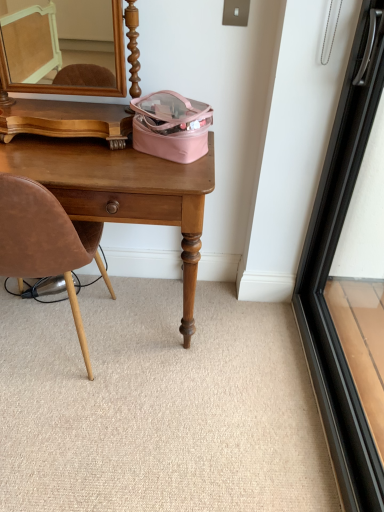
At what (x,y) coordinates should I click in order to perform the action: click on brown leather chair at left. Please return your answer as a coordinate pair (x, y). This screenshot has height=512, width=384. Looking at the image, I should click on (45, 242).

What do you see at coordinates (158, 405) in the screenshot? I see `beige carpet at lower center` at bounding box center [158, 405].

You are a GUI agent. You are given a task and a screenshot of the screen. Output one action in this format:
    pyautogui.click(x=<x>, y=<y>)
    Task: Click on the wooden desk at center
    The width and height of the screenshot is (384, 512).
    Given the screenshot: What is the action you would take?
    pyautogui.click(x=122, y=192)

Could you tell me if brown leather chair at left is turned towards beige carpet at lower center?

No, brown leather chair at left is not facing towards beige carpet at lower center.

In the scene shown: Which of these two, brown leather chair at left or beige carpet at lower center, is smaller?

With smaller size is beige carpet at lower center.

Which of these two, brown leather chair at left or beige carpet at lower center, stands shorter?

Standing shorter between the two is beige carpet at lower center.

From a real-world perspective, who is located higher, brown leather chair at left or beige carpet at lower center?

In real-world perspective, brown leather chair at left is above.

Is beige carpet at lower center taller than black glass screen door at right?

Incorrect, the height of beige carpet at lower center is not larger of that of black glass screen door at right.

Does beige carpet at lower center touch black glass screen door at right?

No, beige carpet at lower center is not touching black glass screen door at right.

Looking at this image, who is smaller, beige carpet at lower center or black glass screen door at right?

With smaller size is beige carpet at lower center.

Between black glass screen door at right and wooden desk at center, which one appears on the right side from the viewer's perspective?

From the viewer's perspective, black glass screen door at right appears more on the right side.

Between black glass screen door at right and wooden desk at center, which one has larger size?

wooden desk at center is bigger.

Who is shorter, black glass screen door at right or wooden desk at center?

wooden desk at center.

Does point (171, 185) appear closer or farther from the camera than point (38, 264)?

Clearly, point (171, 185) is closer to the camera than point (38, 264).

Is wooden desk at center bigger than brown leather chair at left?

Yes.

Does wooden desk at center contain brown leather chair at left?

Absolutely, brown leather chair at left is inside wooden desk at center.

From the image's perspective, is wooden desk at center above or below brown leather chair at left?

wooden desk at center is above brown leather chair at left.

From the picture: Which object is wider, brown leather chair at left or wooden desk at center?

brown leather chair at left.

Between brown leather chair at left and wooden desk at center, which one appears on the left side from the viewer's perspective?

From the viewer's perspective, brown leather chair at left appears more on the left side.

Consider the image. Is brown leather chair at left spatially inside wooden desk at center, or outside of it?

brown leather chair at left fits inside wooden desk at center.

Consider the image. From their relative heights in the image, would you say brown leather chair at left is taller or shorter than wooden desk at center?

brown leather chair at left is taller than wooden desk at center.

At what (x,y) coordinates should I click in order to perform the action: click on desk on the left of beige carpet at lower center. Please return your answer as a coordinate pair (x, y). Looking at the image, I should click on (122, 192).

Is beige carpet at lower center turned away from wooden desk at center?

No, beige carpet at lower center's orientation is not away from wooden desk at center.

Between point (306, 386) and point (9, 167), which one is positioned behind?

The point (306, 386) is farther from the camera.

Consider the image. Is wooden desk at center further to the viewer compared to beige carpet at lower center?

Yes, it is.

From a real-world perspective, which is physically below, wooden desk at center or beige carpet at lower center?

beige carpet at lower center.

Is wooden desk at center placed right next to beige carpet at lower center?

wooden desk at center and beige carpet at lower center are not in contact.

Does wooden desk at center have a larger size compared to beige carpet at lower center?

Indeed, wooden desk at center has a larger size compared to beige carpet at lower center.

Identify the location of chair on the left side of beige carpet at lower center. (45, 242).

The width and height of the screenshot is (384, 512). Find the location of `plain that appears below the black glass screen door at right (from a real-world perspective)`. plain that appears below the black glass screen door at right (from a real-world perspective) is located at coordinates (158, 405).

Looking at the image, which one is located closer to black glass screen door at right, wooden desk at center or beige carpet at lower center?

Based on the image, beige carpet at lower center appears to be nearer to black glass screen door at right.

From the image, which object appears to be nearer to brown leather chair at left, wooden desk at center or black glass screen door at right?

The object closer to brown leather chair at left is wooden desk at center.

Based on the photo, looking at the image, which one is located closer to black glass screen door at right, wooden desk at center or brown leather chair at left?

wooden desk at center is closer to black glass screen door at right.

When comparing their distances from black glass screen door at right, does brown leather chair at left or beige carpet at lower center seem further?

Based on the image, brown leather chair at left appears to be further to black glass screen door at right.

From the image, which object appears to be nearer to wooden desk at center, brown leather chair at left or black glass screen door at right?

brown leather chair at left lies closer to wooden desk at center than the other object.

Which object lies nearer to the anchor point beige carpet at lower center, wooden desk at center or brown leather chair at left?

The object closer to beige carpet at lower center is brown leather chair at left.

Based on their spatial positions, is wooden desk at center or beige carpet at lower center further from brown leather chair at left?

beige carpet at lower center.

Based on their spatial positions, is wooden desk at center or black glass screen door at right closer to beige carpet at lower center?

Based on the image, wooden desk at center appears to be nearer to beige carpet at lower center.

Where is `chair between wooden desk at center and beige carpet at lower center vertically`? chair between wooden desk at center and beige carpet at lower center vertically is located at coordinates (45, 242).

What are the coordinates of `plain between brown leather chair at left and black glass screen door at right` in the screenshot? It's located at (158, 405).

Find the location of a particular element. The image size is (384, 512). desk between brown leather chair at left and black glass screen door at right from left to right is located at coordinates (122, 192).

Image resolution: width=384 pixels, height=512 pixels. I want to click on plain between wooden desk at center and black glass screen door at right from left to right, so click(x=158, y=405).